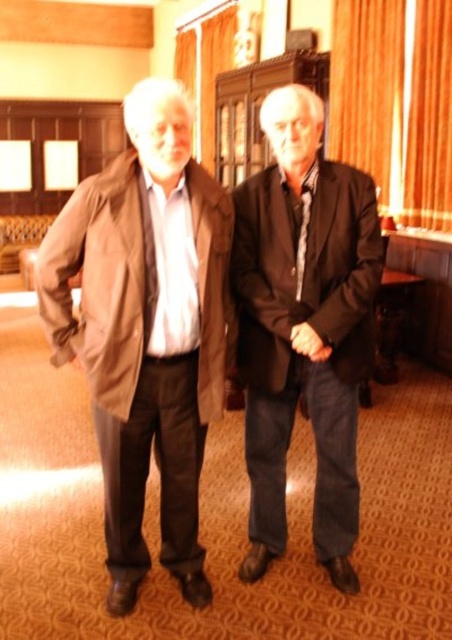
Does brown leather jacket at center have a greater width compared to dark brown leather jacket at center?

Correct, the width of brown leather jacket at center exceeds that of dark brown leather jacket at center.

Can you confirm if brown leather jacket at center is taller than dark brown leather jacket at center?

Yes, brown leather jacket at center is taller than dark brown leather jacket at center.

The height and width of the screenshot is (640, 452). I want to click on brown leather jacket at center, so click(146, 328).